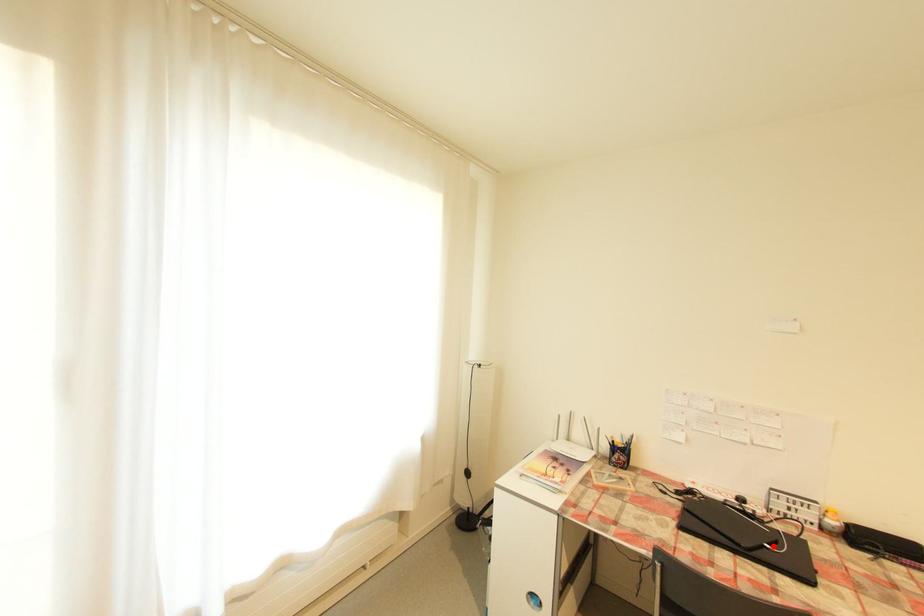
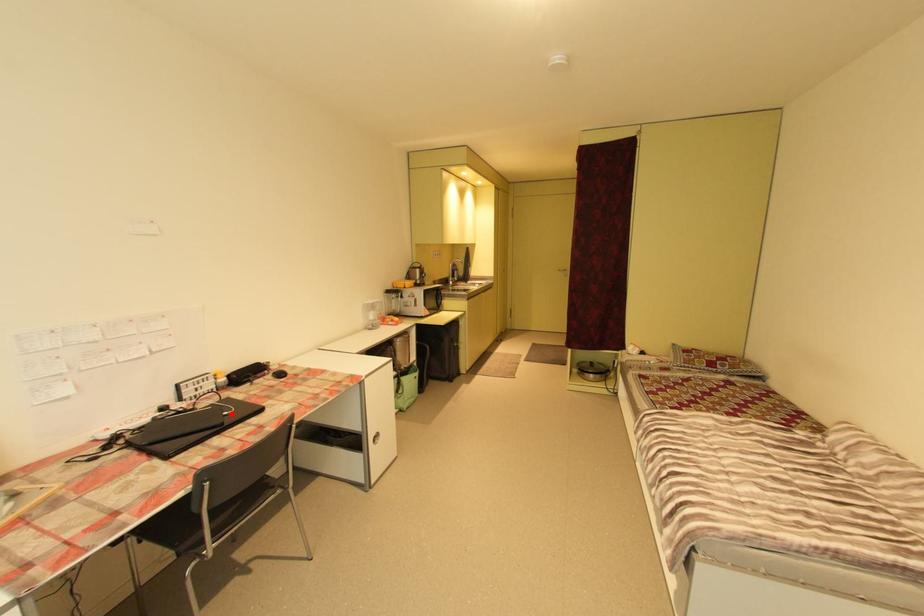
I am providing you with two images of the same scene from different viewpoints. A red point is marked on the first image and another point is marked on the second image. Is the marked point in image1 the same physical position as the marked point in image2?

Yes